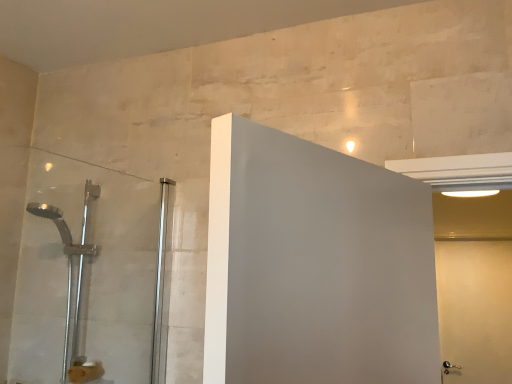
What do you see at coordinates (78, 266) in the screenshot? The width and height of the screenshot is (512, 384). I see `satin chrome shower door at left` at bounding box center [78, 266].

At what (x,y) coordinates should I click in order to perform the action: click on satin chrome shower door at left. Please return your answer as a coordinate pair (x, y). Looking at the image, I should click on (78, 266).

The width and height of the screenshot is (512, 384). What do you see at coordinates (475, 309) in the screenshot?
I see `white matte door at right` at bounding box center [475, 309].

You are a GUI agent. You are given a task and a screenshot of the screen. Output one action in this format:
    pyautogui.click(x=<x>, y=<y>)
    Task: Click on the white matte door at right
    
    Given the screenshot: What is the action you would take?
    pyautogui.click(x=475, y=309)

Find the location of a particular element. The image size is (512, 384). satin chrome shower door at left is located at coordinates (78, 266).

Which is more to the right, satin chrome shower door at left or white matte door at right?

white matte door at right is more to the right.

Is satin chrome shower door at left positioned before white matte door at right?

Yes, the depth of satin chrome shower door at left is less than that of white matte door at right.

Which point is more distant from viewer, (138, 363) or (488, 378)?

The point (488, 378) is farther.

From the image's perspective, is satin chrome shower door at left located beneath white matte door at right?

No, from the image's perspective, satin chrome shower door at left is not below white matte door at right.

From a real-world perspective, is satin chrome shower door at left positioned under white matte door at right based on gravity?

No, from a real-world perspective, satin chrome shower door at left is not under white matte door at right.

In terms of width, does satin chrome shower door at left look wider or thinner when compared to white matte door at right?

Clearly, satin chrome shower door at left has more width compared to white matte door at right.

Can you confirm if satin chrome shower door at left is taller than white matte door at right?

No, satin chrome shower door at left is not taller than white matte door at right.

Between satin chrome shower door at left and white matte door at right, which one has smaller size?

Smaller between the two is white matte door at right.

Is satin chrome shower door at left outside of white matte door at right?

satin chrome shower door at left lies outside white matte door at right's area.

Are satin chrome shower door at left and white matte door at right making contact?

satin chrome shower door at left and white matte door at right are clearly separated.

Is satin chrome shower door at left oriented away from white matte door at right?

satin chrome shower door at left does not have its back to white matte door at right.

How many degrees apart are the facing directions of satin chrome shower door at left and white matte door at right?

They differ by 88.9 degrees in their facing directions.

The image size is (512, 384). I want to click on screen door behind the satin chrome shower door at left, so click(x=475, y=309).

Considering the relative positions of white matte door at right and satin chrome shower door at left in the image provided, is white matte door at right to the right of satin chrome shower door at left from the viewer's perspective?

Correct, you'll find white matte door at right to the right of satin chrome shower door at left.

Does white matte door at right lie in front of satin chrome shower door at left?

No.

Is point (498, 272) more distant than point (131, 273)?

Yes, point (498, 272) is farther from viewer.

From the image's perspective, which one is positioned lower, white matte door at right or satin chrome shower door at left?

white matte door at right, from the image's perspective.

From a real-world perspective, is white matte door at right above or below satin chrome shower door at left?

In terms of real-world spatial position, white matte door at right is below satin chrome shower door at left.

Which object is thinner, white matte door at right or satin chrome shower door at left?

With smaller width is white matte door at right.

Considering the relative sizes of white matte door at right and satin chrome shower door at left in the image provided, is white matte door at right shorter than satin chrome shower door at left?

In fact, white matte door at right may be taller than satin chrome shower door at left.

Between white matte door at right and satin chrome shower door at left, which one has smaller size?

white matte door at right.

Is satin chrome shower door at left inside white matte door at right?

Definitely not — satin chrome shower door at left is not inside white matte door at right.

Is the surface of white matte door at right in direct contact with satin chrome shower door at left?

No, white matte door at right is not making contact with satin chrome shower door at left.

Is satin chrome shower door at left at the back of white matte door at right?

No, white matte door at right's orientation is not away from satin chrome shower door at left.

How distant is white matte door at right from satin chrome shower door at left?

The distance of white matte door at right from satin chrome shower door at left is 2.83 meters.

This screenshot has width=512, height=384. I want to click on shower door that is on the left side of white matte door at right, so click(78, 266).

Where is `shower door to the left of white matte door at right`? shower door to the left of white matte door at right is located at coordinates (78, 266).

The width and height of the screenshot is (512, 384). I want to click on shower door above the white matte door at right (from a real-world perspective), so click(78, 266).